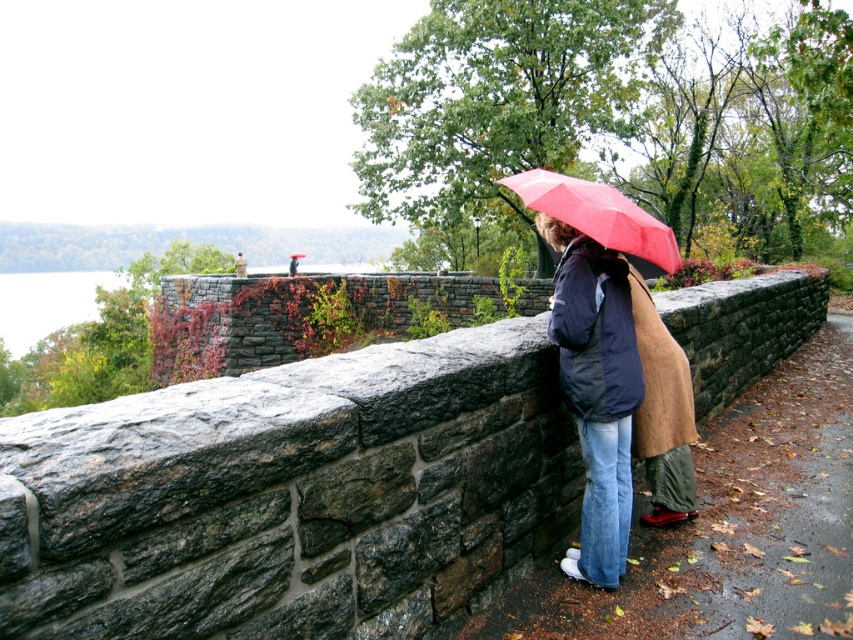
Question: Which of the following is the closest to the observer?

Choices:
 (A) stone wall at center
 (B) matte black jacket at center

Answer: (B)

Question: Can you confirm if stone wall at center is wider than matte black jacket at center?

Choices:
 (A) yes
 (B) no

Answer: (B)

Question: Does stone wall at center have a lesser width compared to matte black jacket at center?

Choices:
 (A) yes
 (B) no

Answer: (A)

Question: Considering the relative positions of matte black jacket at center and matte red umbrella at upper center in the image provided, where is matte black jacket at center located with respect to matte red umbrella at upper center?

Choices:
 (A) left
 (B) right

Answer: (B)

Question: Estimate the real-world distances between objects in this image. Which object is closer to the matte black jacket at center?

Choices:
 (A) matte red umbrella at upper center
 (B) stone wall at center

Answer: (B)

Question: Which object appears closest to the camera in this image?

Choices:
 (A) matte red umbrella at upper center
 (B) matte black jacket at center

Answer: (A)